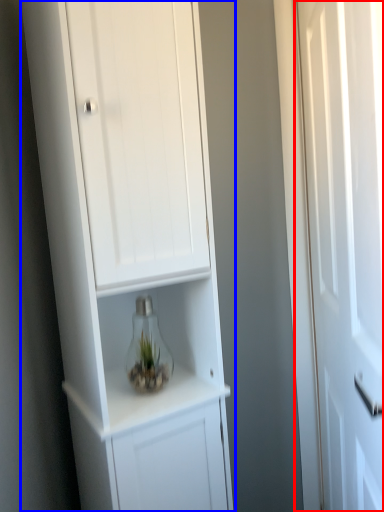
Question: Among these objects, which one is nearest to the camera, door (highlighted by a red box) or cupboard (highlighted by a blue box)?

Choices:
 (A) door
 (B) cupboard

Answer: (A)